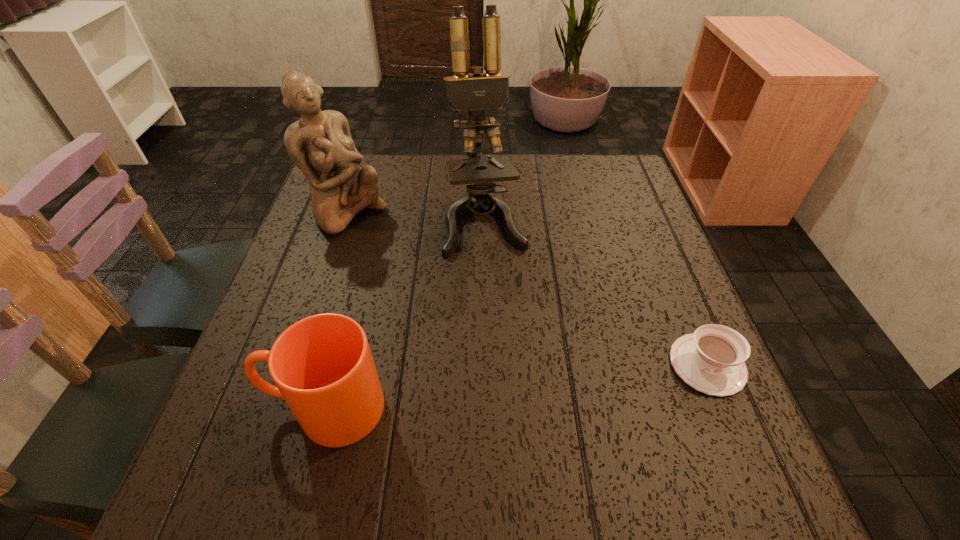
Identify the location of mug. (x=322, y=365).

This screenshot has height=540, width=960. In order to click on the rightmost object in this screenshot , I will do `click(711, 360)`.

Where is `the shortest object`? The image size is (960, 540). the shortest object is located at coordinates (711, 360).

Image resolution: width=960 pixels, height=540 pixels. In order to click on the second tallest object in this screenshot , I will do `click(320, 144)`.

You are a GUI agent. You are given a task and a screenshot of the screen. Output one action in this format:
    pyautogui.click(x=<x>, y=<y>)
    Task: Click on the microscope
    This screenshot has width=960, height=540.
    Given the screenshot: What is the action you would take?
    pyautogui.click(x=474, y=92)

This screenshot has width=960, height=540. Identify the location of the tallest object. (474, 92).

Locate an element on the screen. free point located 0.120m on the front-facing side of the second tallest object is located at coordinates (401, 254).

I want to click on vacant space positioned on the front-facing side of the second tallest object, so click(444, 287).

Find the location of a particular element. This screenshot has width=960, height=540. free region located on the front-facing side of the second tallest object is located at coordinates (456, 296).

This screenshot has height=540, width=960. Identify the location of vacant position located 0.380m at the eyepieces of the tallest object. (527, 406).